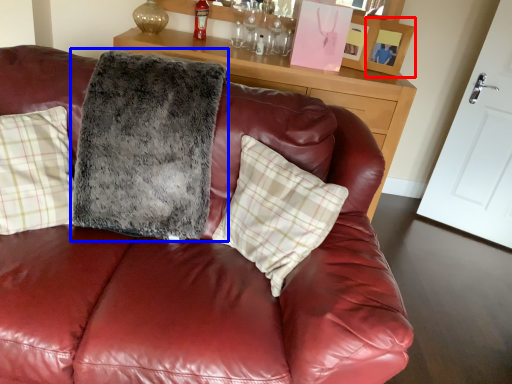
Question: Which point is closer to the camera, picture frame (highlighted by a red box) or blanket (highlighted by a blue box)?

Choices:
 (A) picture frame
 (B) blanket

Answer: (B)